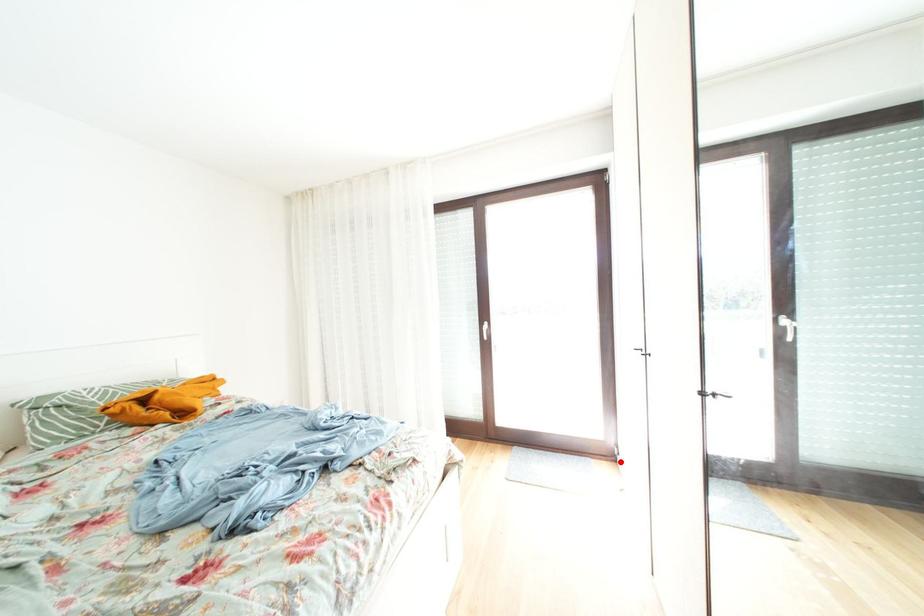
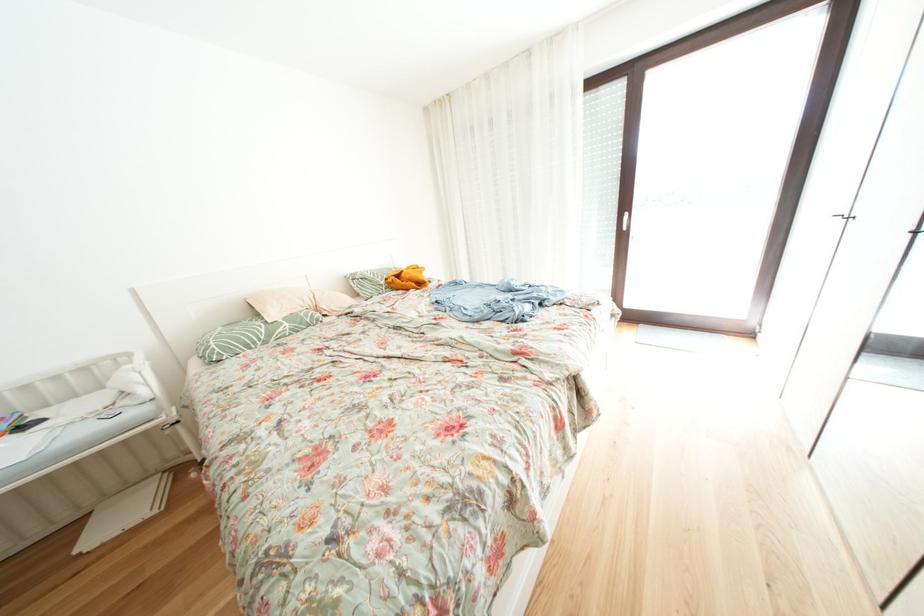
Question: I am providing you with two images of the same scene from different viewpoints. In image1, a red point is highlighted. Considering the same 3D point in image2, which of the following is correct?

Choices:
 (A) It is closer
 (B) It is farther

Answer: (A)